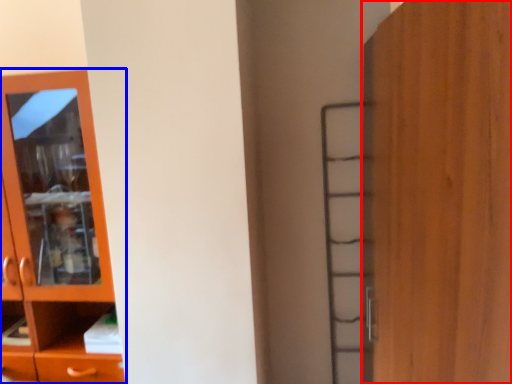
Question: Which of the following is the farthest to the observer, door (highlighted by a red box) or cupboard (highlighted by a blue box)?

Choices:
 (A) door
 (B) cupboard

Answer: (B)